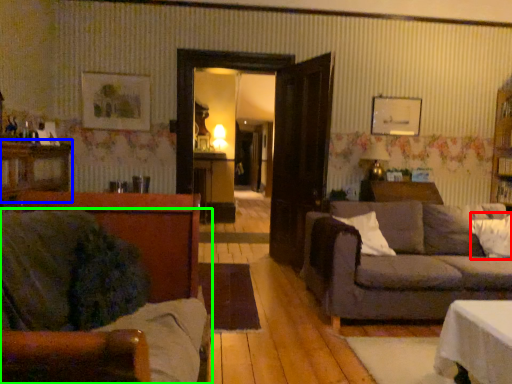
Question: Which object is positioned farthest from pillow (highlighted by a red box)? Select from dresser (highlighted by a blue box) and studio couch (highlighted by a green box).

Choices:
 (A) dresser
 (B) studio couch

Answer: (A)